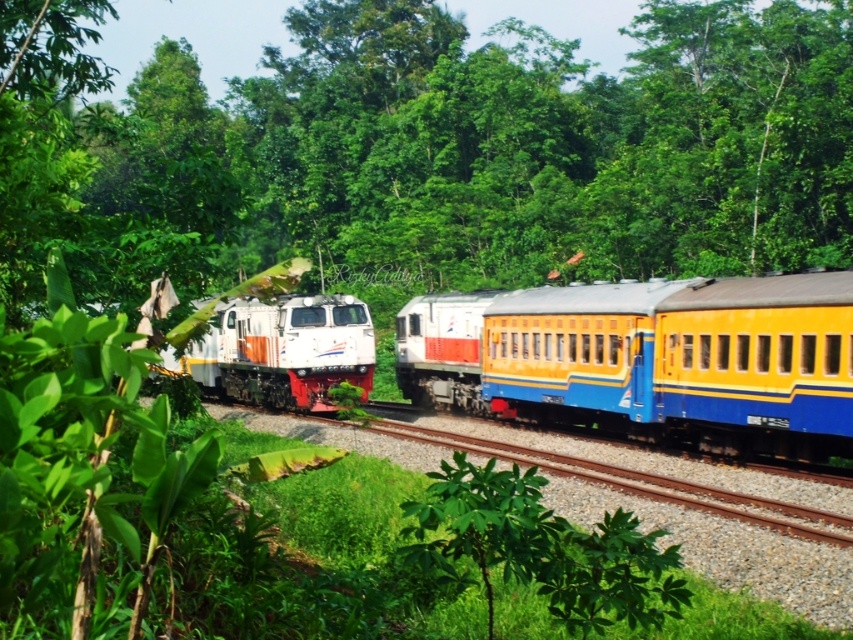
Who is shorter, green leafy tree at center or white glossy locomotive at center?

white glossy locomotive at center

Between green leafy tree at center and white glossy locomotive at center, which one appears on the right side from the viewer's perspective?

From the viewer's perspective, white glossy locomotive at center appears more on the right side.

At what (x,y) coordinates should I click in order to perform the action: click on green leafy tree at center. Please return your answer as a coordinate pair (x, y). Image resolution: width=853 pixels, height=640 pixels. Looking at the image, I should click on (434, 152).

Who is higher up, yellow matte train car at center or white glossy locomotive at center?

white glossy locomotive at center

The width and height of the screenshot is (853, 640). Describe the element at coordinates (660, 362) in the screenshot. I see `yellow matte train car at center` at that location.

Is point (503, 385) closer to camera compared to point (370, 339)?

Yes, point (503, 385) is in front of point (370, 339).

Find the location of `yellow matte train car at center`. yellow matte train car at center is located at coordinates (660, 362).

Does point (387, 234) lie in front of point (598, 337)?

No, (387, 234) is further to viewer.

Does point (541, 60) lie behind point (578, 317)?

Yes, it is.

This screenshot has width=853, height=640. Find the location of `green leafy tree at center`. green leafy tree at center is located at coordinates (434, 152).